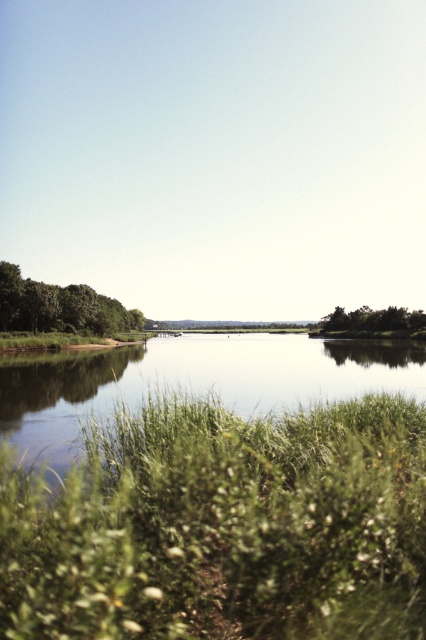
Question: Can you confirm if green fuzzy grass at lower center is positioned to the right of green leafy tree at center?

Choices:
 (A) yes
 (B) no

Answer: (B)

Question: Which point is farther to the camera?

Choices:
 (A) (351, 314)
 (B) (40, 394)
 (C) (199, 435)
 (D) (51, 308)

Answer: (A)

Question: Which point appears farthest from the camera in this image?

Choices:
 (A) (66, 355)
 (B) (199, 468)
 (C) (362, 330)

Answer: (C)

Question: Observing the image, what is the correct spatial positioning of green fuzzy grass at lower center in reference to green leafy tree at center?

Choices:
 (A) left
 (B) right

Answer: (A)

Question: Observing the image, what is the correct spatial positioning of green matte tree at left in reference to green leafy tree at center?

Choices:
 (A) above
 (B) below

Answer: (B)

Question: Which of these objects is positioned closest to the green grassy river at center?

Choices:
 (A) green matte tree at left
 (B) green fuzzy grass at lower center

Answer: (B)